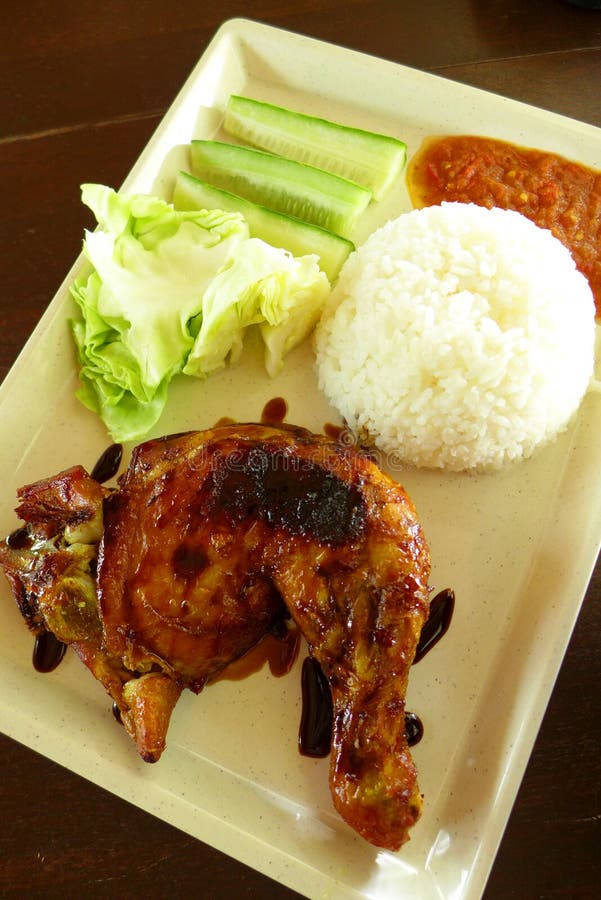
Locate an element on the screen. horizonal lines in wood table is located at coordinates (486, 58), (53, 130).